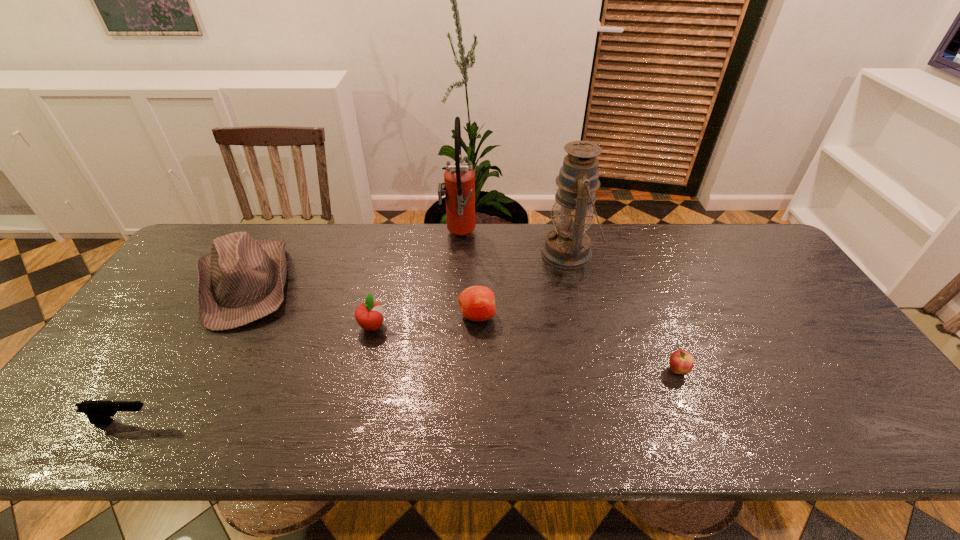
The height and width of the screenshot is (540, 960). What are the coordinates of `fire extinguisher` in the screenshot? It's located at (459, 178).

Image resolution: width=960 pixels, height=540 pixels. I want to click on the second object from right to left, so click(567, 246).

Identify the location of fedora. (242, 280).

Identify the location of the second apple from left to right. The height and width of the screenshot is (540, 960). (476, 303).

In order to click on the third object from left to right in this screenshot , I will do `click(369, 315)`.

The image size is (960, 540). I want to click on the nearest object, so click(x=98, y=412).

What are the coordinates of `the second nearest object` in the screenshot? It's located at (681, 362).

Locate an element on the screen. This screenshot has height=540, width=960. the nearest apple is located at coordinates (681, 362).

The height and width of the screenshot is (540, 960). I want to click on free region located at the nozzle of the fire extinguisher, so click(x=593, y=236).

Find the location of a particular element. This screenshot has width=960, height=540. free space located 0.130m on the left of the sixth object from left to right is located at coordinates (501, 253).